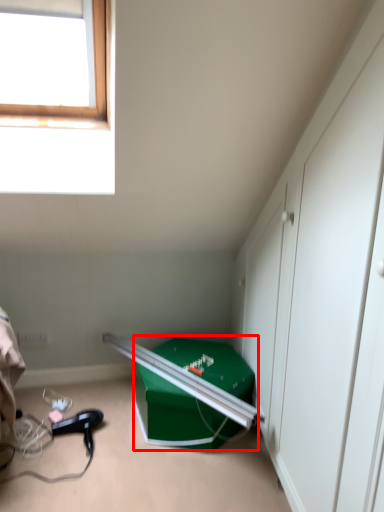
Question: In this image, where is box (annotated by the red box) located relative to hair drier?

Choices:
 (A) left
 (B) right

Answer: (B)